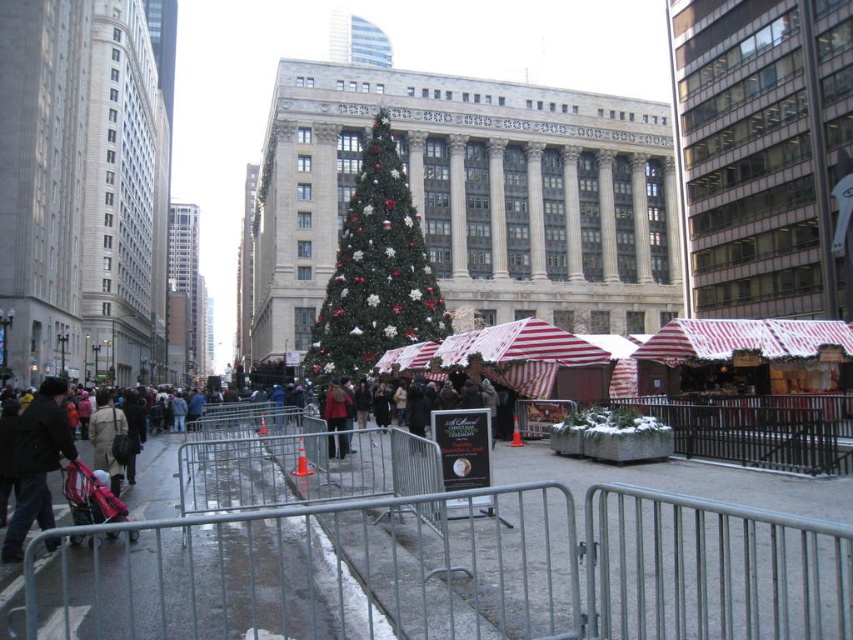
Question: Which point is closer to the camera taking this photo?

Choices:
 (A) (328, 388)
 (B) (45, 525)

Answer: (B)

Question: Based on their relative distances, which object is nearer to the green matte christmas tree at center?

Choices:
 (A) red wool coat at center
 (B) dark gray jacket at lower left

Answer: (A)

Question: Does green matte christmas tree at center have a larger size compared to dark gray jacket at lower left?

Choices:
 (A) no
 (B) yes

Answer: (B)

Question: Considering the relative positions of green matte christmas tree at center and red wool coat at center in the image provided, where is green matte christmas tree at center located with respect to red wool coat at center?

Choices:
 (A) right
 (B) left

Answer: (A)

Question: Which object appears closest to the camera in this image?

Choices:
 (A) green matte christmas tree at center
 (B) red wool coat at center
 (C) dark gray jacket at lower left

Answer: (C)

Question: Is green matte christmas tree at center further to camera compared to red wool coat at center?

Choices:
 (A) no
 (B) yes

Answer: (B)